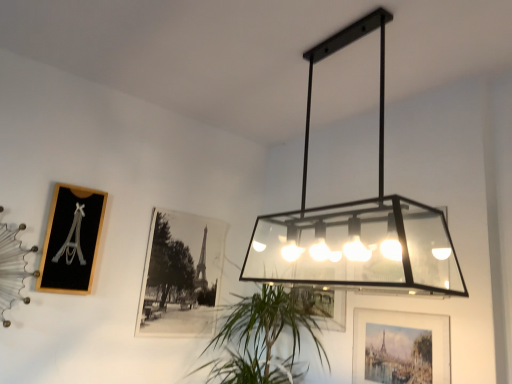
Question: Is there a large distance between matte black rectangular light fixture at upper center and matte glass picture frame at lower right, which ranks as the first picture frame in right-to-left order?

Choices:
 (A) yes
 (B) no

Answer: (B)

Question: From the image's perspective, would you say matte black rectangular light fixture at upper center is positioned over matte glass picture frame at lower right, which ranks as the first picture frame in right-to-left order?

Choices:
 (A) no
 (B) yes

Answer: (B)

Question: Considering the relative sizes of matte black rectangular light fixture at upper center and matte glass picture frame at lower right, positioned as the third picture frame in left-to-right order, in the image provided, is matte black rectangular light fixture at upper center thinner than matte glass picture frame at lower right, positioned as the third picture frame in left-to-right order,?

Choices:
 (A) yes
 (B) no

Answer: (B)

Question: Is matte black rectangular light fixture at upper center completely or partially outside of matte glass picture frame at lower right, which ranks as the first picture frame in right-to-left order?

Choices:
 (A) yes
 (B) no

Answer: (A)

Question: From a real-world perspective, is matte black rectangular light fixture at upper center beneath matte glass picture frame at lower right, which ranks as the first picture frame in right-to-left order?

Choices:
 (A) no
 (B) yes

Answer: (A)

Question: Is matte black rectangular light fixture at upper center directly adjacent to matte glass picture frame at lower right, positioned as the third picture frame in left-to-right order?

Choices:
 (A) yes
 (B) no

Answer: (B)

Question: Considering the relative sizes of matte black rectangular light fixture at upper center and green leafy plant at center in the image provided, is matte black rectangular light fixture at upper center bigger than green leafy plant at center?

Choices:
 (A) no
 (B) yes

Answer: (A)

Question: Is matte black rectangular light fixture at upper center not within green leafy plant at center?

Choices:
 (A) no
 (B) yes

Answer: (B)

Question: From a real-world perspective, is matte black rectangular light fixture at upper center located higher than green leafy plant at center?

Choices:
 (A) no
 (B) yes

Answer: (B)

Question: Is matte black rectangular light fixture at upper center turned away from green leafy plant at center?

Choices:
 (A) yes
 (B) no

Answer: (B)

Question: Can you confirm if matte black rectangular light fixture at upper center is positioned to the left of green leafy plant at center?

Choices:
 (A) no
 (B) yes

Answer: (A)

Question: Is matte black rectangular light fixture at upper center positioned far away from green leafy plant at center?

Choices:
 (A) no
 (B) yes

Answer: (A)

Question: Is the depth of matte black rectangular light fixture at upper center greater than that of black wood picture frame at left, which appears as the 1th picture frame when viewed from the left?

Choices:
 (A) yes
 (B) no

Answer: (B)